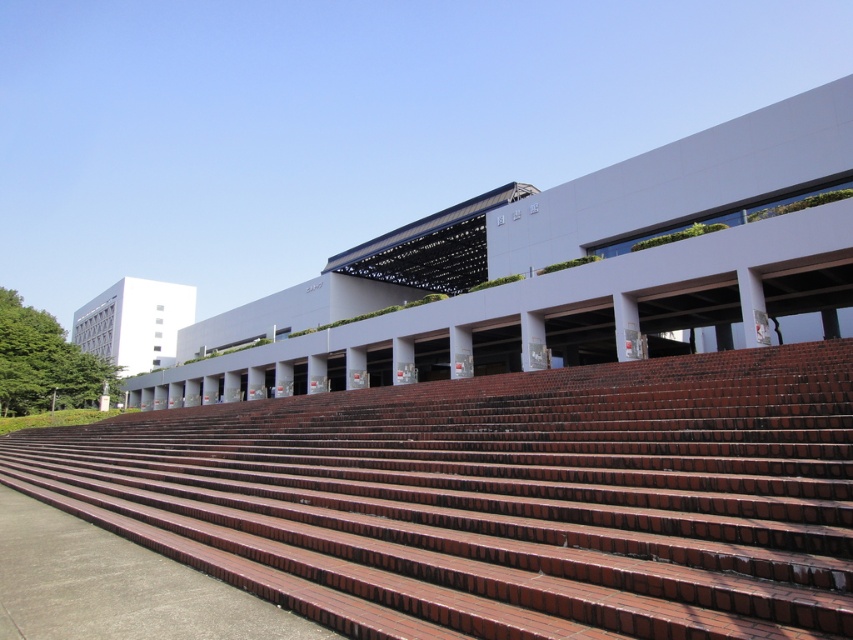
Is brown brick stairs at center to the left of brown brick amphitheater at center from the viewer's perspective?

No, brown brick stairs at center is not to the left of brown brick amphitheater at center.

Is brown brick stairs at center bigger than brown brick amphitheater at center?

Incorrect, brown brick stairs at center is not larger than brown brick amphitheater at center.

This screenshot has width=853, height=640. Describe the element at coordinates (500, 499) in the screenshot. I see `brown brick stairs at center` at that location.

The width and height of the screenshot is (853, 640). In order to click on brown brick stairs at center in this screenshot , I will do coord(500,499).